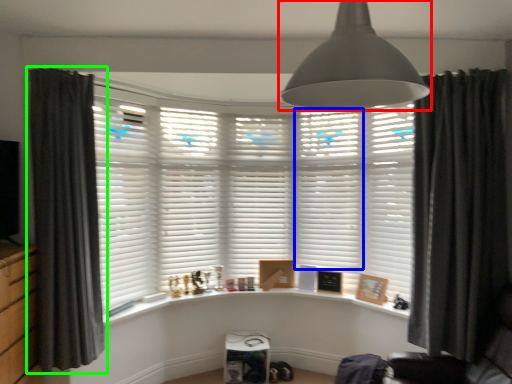
Question: Which object is positioned farthest from light fixture (highlighted by a red box)? Select from shutter (highlighted by a blue box) and curtain (highlighted by a green box).

Choices:
 (A) shutter
 (B) curtain

Answer: (A)